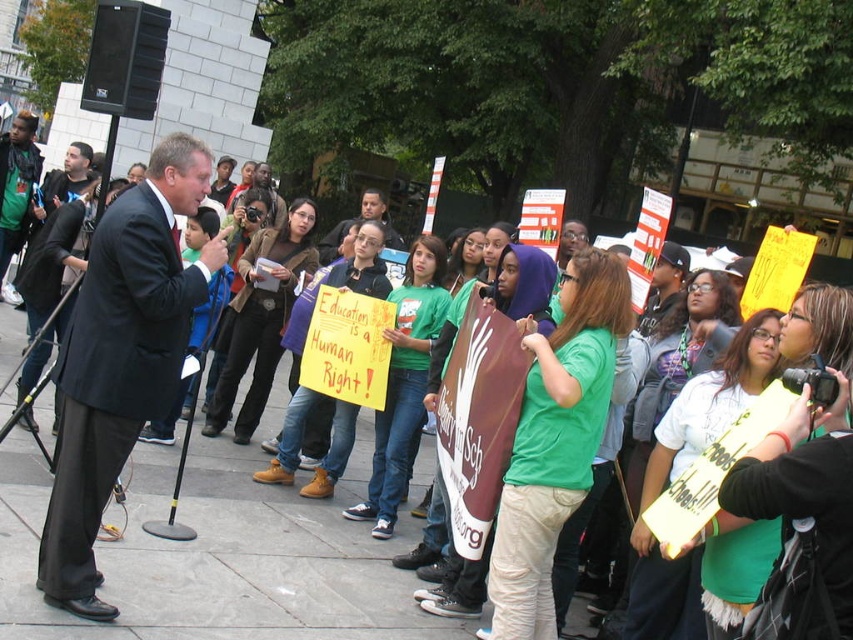
Question: Is black suit at left closer to camera compared to matte black suit at center?

Choices:
 (A) no
 (B) yes

Answer: (B)

Question: Among these objects, which one is nearest to the camera?

Choices:
 (A) matte black suit at center
 (B) black suit at left

Answer: (B)

Question: Among these objects, which one is nearest to the camera?

Choices:
 (A) black suit at left
 (B) matte black suit at center

Answer: (A)

Question: Is black suit at left wider than matte black suit at center?

Choices:
 (A) yes
 (B) no

Answer: (B)

Question: Is black suit at left further to camera compared to matte black suit at center?

Choices:
 (A) no
 (B) yes

Answer: (A)